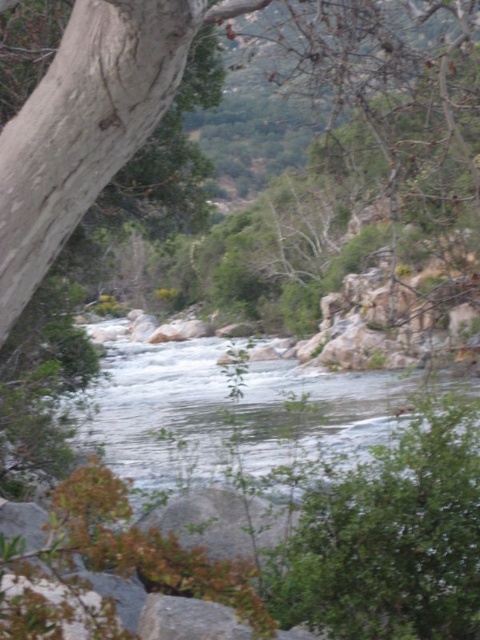
Question: Considering the relative positions of clear water at center and gray rough rock at center in the image provided, where is clear water at center located with respect to gray rough rock at center?

Choices:
 (A) above
 (B) below

Answer: (B)

Question: Which of the following is the closest to the observer?

Choices:
 (A) (166, 524)
 (B) (170, 352)

Answer: (A)

Question: Is clear water at center bigger than gray rough rock at center?

Choices:
 (A) no
 (B) yes

Answer: (B)

Question: Which point is closer to the camera?

Choices:
 (A) gray rough rock at center
 (B) clear water at center

Answer: (B)

Question: Is clear water at center smaller than gray rough rock at center?

Choices:
 (A) yes
 (B) no

Answer: (B)